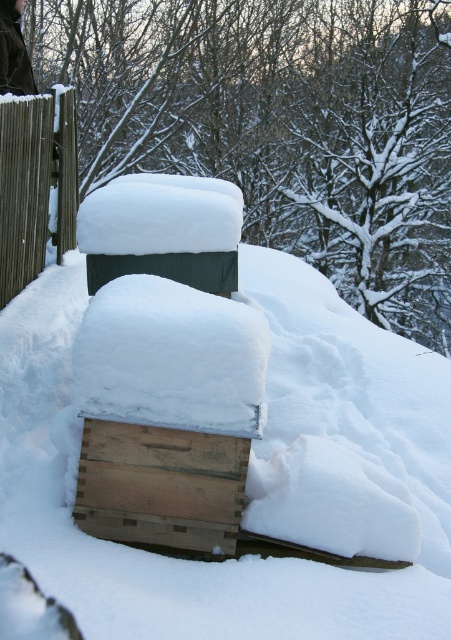
Question: Does wooden crate at center appear under brown wooden fence at left?

Choices:
 (A) no
 (B) yes

Answer: (B)

Question: Is wooden crate at center in front of brown wooden fence at left?

Choices:
 (A) no
 (B) yes

Answer: (B)

Question: Which point is closer to the camera taking this photo?

Choices:
 (A) (179, 438)
 (B) (4, 209)

Answer: (A)

Question: Which object appears farthest from the camera in this image?

Choices:
 (A) brown wooden fence at left
 (B) wooden crate at center

Answer: (A)

Question: Does wooden crate at center have a greater width compared to brown wooden fence at left?

Choices:
 (A) yes
 (B) no

Answer: (A)